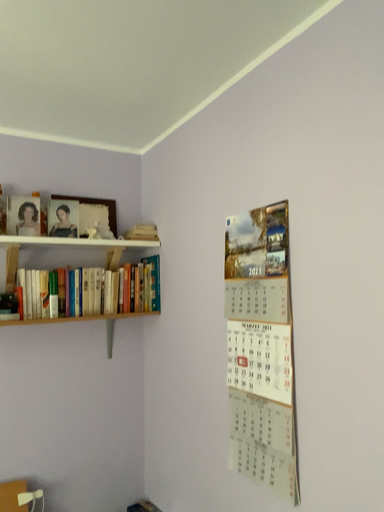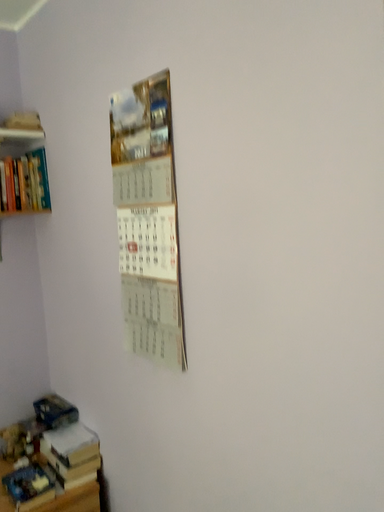
Question: How did the camera likely rotate when shooting the video?

Choices:
 (A) rotated downward
 (B) rotated upward

Answer: (A)